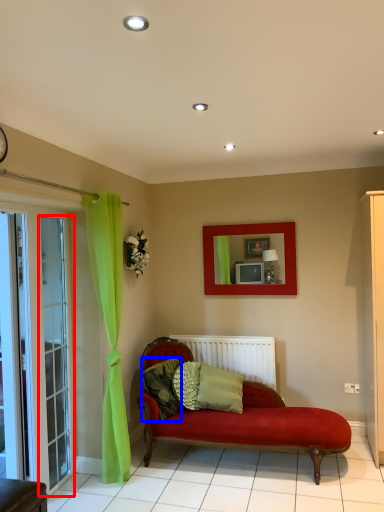
Question: Which of the following is the farthest to the observer, glass door (highlighted by a red box) or pillow (highlighted by a blue box)?

Choices:
 (A) glass door
 (B) pillow

Answer: (B)